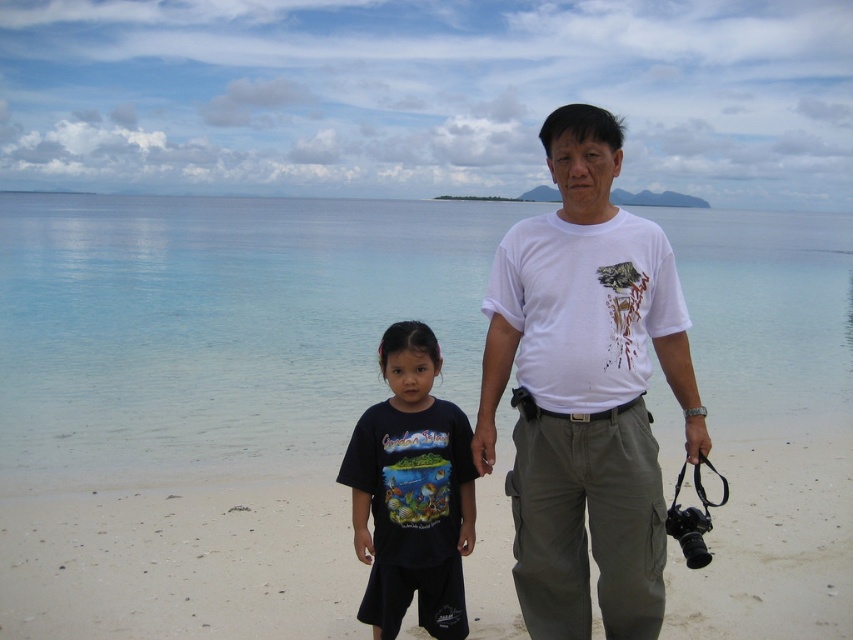
What do you see at coordinates (181, 564) in the screenshot? The image size is (853, 640). I see `beige sand at lower center` at bounding box center [181, 564].

Is beige sand at lower center to the left of black cotton shirt at center from the viewer's perspective?

Yes, beige sand at lower center is to the left of black cotton shirt at center.

Between point (521, 637) and point (404, 422), which one is positioned behind?

The point (521, 637) is behind.

What are the coordinates of `beige sand at lower center` in the screenshot? It's located at (181, 564).

Does clear blue water at center lie in front of black cotton shirt at center?

Yes, clear blue water at center is closer to the viewer.

Between clear blue water at center and black cotton shirt at center, which one is positioned lower?

black cotton shirt at center is below.

What do you see at coordinates (219, 326) in the screenshot? Image resolution: width=853 pixels, height=640 pixels. I see `clear blue water at center` at bounding box center [219, 326].

The image size is (853, 640). In order to click on clear blue water at center in this screenshot , I will do `click(219, 326)`.

Describe the element at coordinates (585, 390) in the screenshot. I see `white cotton t-shirt at center` at that location.

Does white cotton t-shirt at center appear on the left side of black cotton shirt at center?

Incorrect, white cotton t-shirt at center is not on the left side of black cotton shirt at center.

Is point (515, 394) positioned before point (444, 492)?

Yes, it is.

This screenshot has height=640, width=853. Find the location of `white cotton t-shirt at center`. white cotton t-shirt at center is located at coordinates (585, 390).